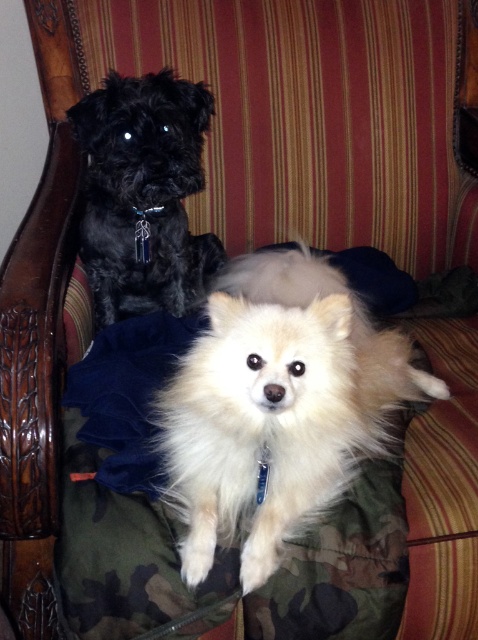
You are standing in front of a couch with two dogs. There is a point at coordinates (276,406). Which dog is located at this point?

The white fluffy dog at center is located at point (276,406).

You are a photographer trying to capture a portrait of both the white fluffy dog at center and the shiny black fur at upper left. Which dog should you focus on first if you want to ensure both are in focus?

The white fluffy dog at center is taller than the shiny black fur at upper left, so focusing on the taller white fluffy dog at center first would help ensure both are in focus.

From the picture: You are a photographer trying to capture both the white fluffy dog at center and the shiny black fur at upper left in the same frame. Given that your camera has a maximum focus range of 12 inches, will you be able to focus on both subjects simultaneously?

The distance between the white fluffy dog at center and the shiny black fur at upper left is 12.86 inches, which exceeds the camera maximum focus range of 12 inches. Therefore, you cannot focus on both subjects simultaneously.